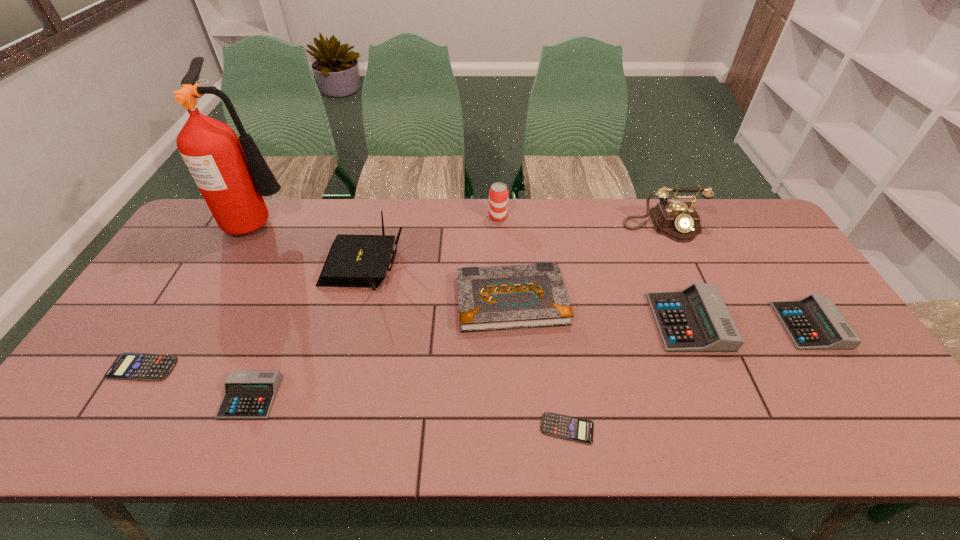
In the image, there is a desktop. Where is `vacant space at the near left corner`? Image resolution: width=960 pixels, height=540 pixels. vacant space at the near left corner is located at coordinates (100, 418).

I want to click on free area in between the red fire extinguisher and the farther blue calculator, so click(x=203, y=294).

Locate an element on the screen. The height and width of the screenshot is (540, 960). free space between the beer can and the fire extinguisher is located at coordinates (379, 219).

The image size is (960, 540). What are the coordinates of `unoccupied position between the eighth tallest object and the second shortest object` in the screenshot? It's located at (197, 382).

In order to click on empty space between the nearer blue calculator and the second gray calculator from left to right in this screenshot , I will do `click(628, 375)`.

Where is `free spot between the rightmost gray calculator and the beer can`? free spot between the rightmost gray calculator and the beer can is located at coordinates (654, 271).

Locate an element on the screen. This screenshot has width=960, height=540. vacant point located between the smallest gray calculator and the biggest gray calculator is located at coordinates (469, 360).

The image size is (960, 540). I want to click on free spot between the router and the telephone, so click(x=514, y=246).

In order to click on free space between the beer can and the ninth shortest object in this screenshot , I will do `click(581, 221)`.

Where is `empty location between the right blue calculator and the bigger blue calculator`? The height and width of the screenshot is (540, 960). empty location between the right blue calculator and the bigger blue calculator is located at coordinates (355, 398).